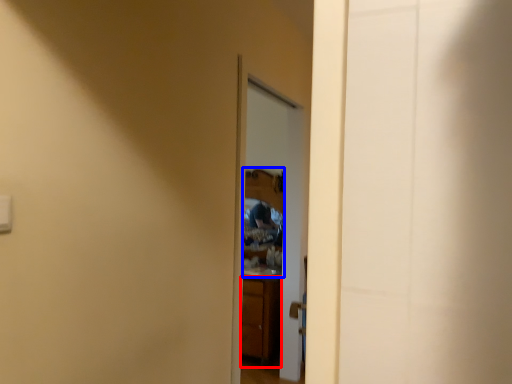
Question: Which object is further to the camera taking this photo, cabinetry (highlighted by a red box) or mirror (highlighted by a blue box)?

Choices:
 (A) cabinetry
 (B) mirror

Answer: (A)